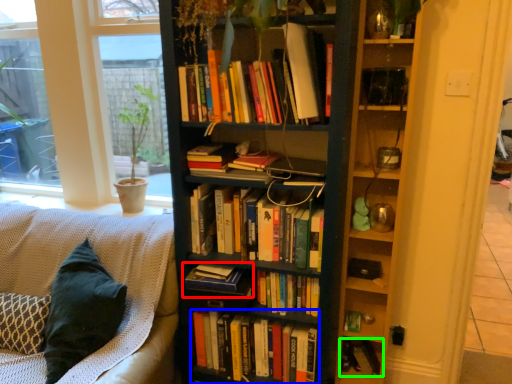
Question: Based on their relative distances, which object is farther from book (highlighted by a red box)? Choose from book (highlighted by a blue box) and book (highlighted by a green box).

Choices:
 (A) book
 (B) book

Answer: (B)